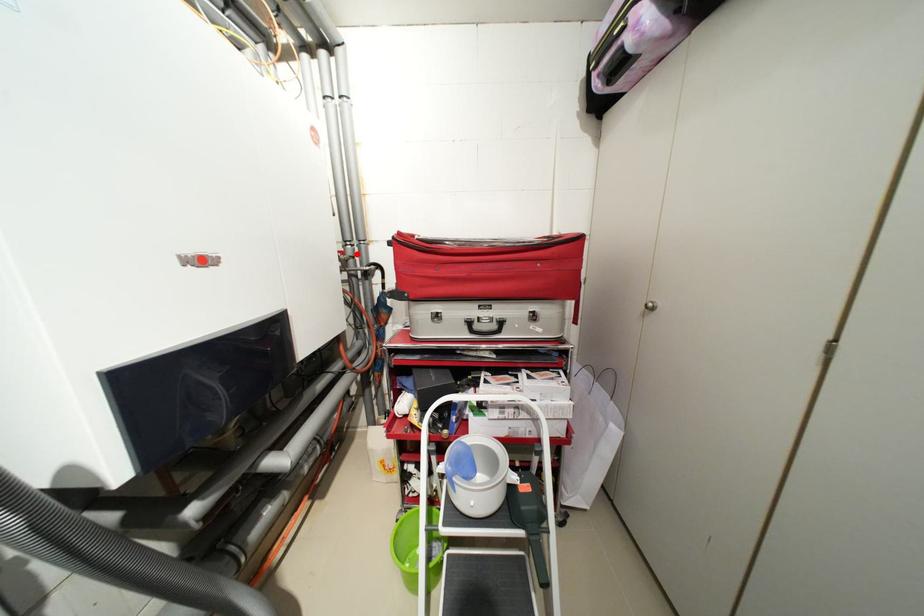
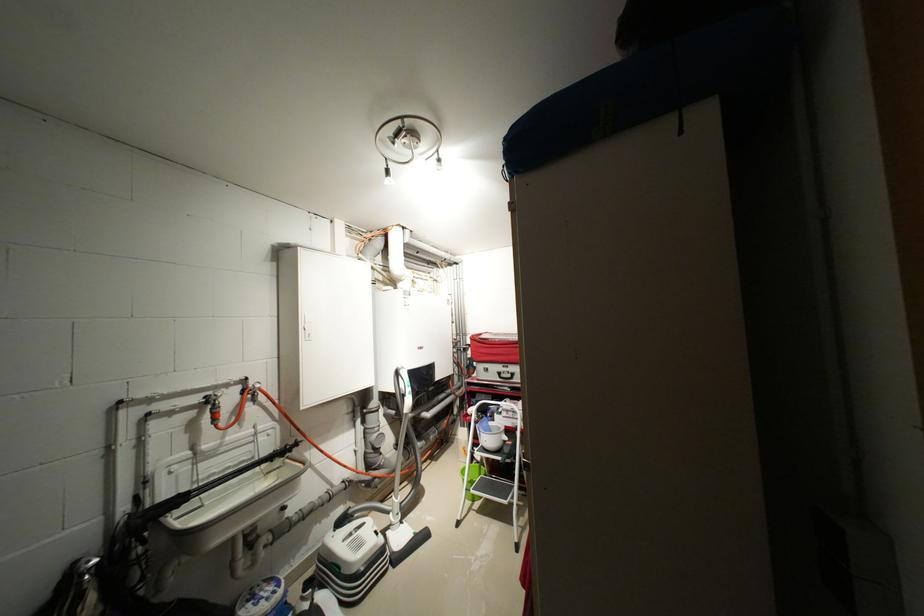
Where in the second image is the point corresponding to the highlighted location from the first image?

(466, 341)